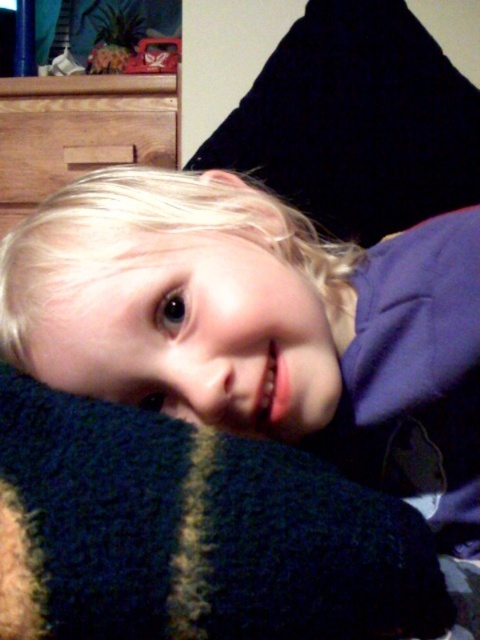
Question: Is blonde hair at center below dark blue knitted blanket at center?

Choices:
 (A) yes
 (B) no

Answer: (B)

Question: Which point appears farthest from the camera in this image?

Choices:
 (A) (143, 632)
 (B) (459, 465)

Answer: (B)

Question: Does blonde hair at center have a smaller size compared to dark blue knitted blanket at center?

Choices:
 (A) no
 (B) yes

Answer: (A)

Question: Which point is closer to the camera?

Choices:
 (A) blonde hair at center
 (B) dark blue knitted blanket at center

Answer: (B)

Question: Can you confirm if blonde hair at center is positioned to the right of dark blue knitted blanket at center?

Choices:
 (A) no
 (B) yes

Answer: (B)

Question: Which point is farther to the camera?

Choices:
 (A) blonde hair at center
 (B) dark blue knitted blanket at center

Answer: (A)